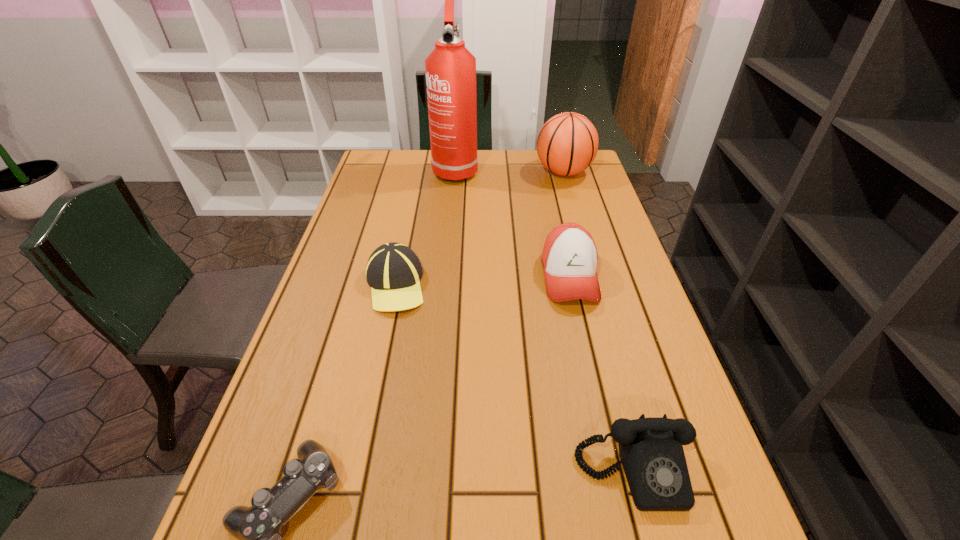
At what (x,y) coordinates should I click in order to perform the action: click on object that can be found as the second closest to the left baseball cap. Please return your answer as a coordinate pair (x, y). Image resolution: width=960 pixels, height=540 pixels. Looking at the image, I should click on (258, 528).